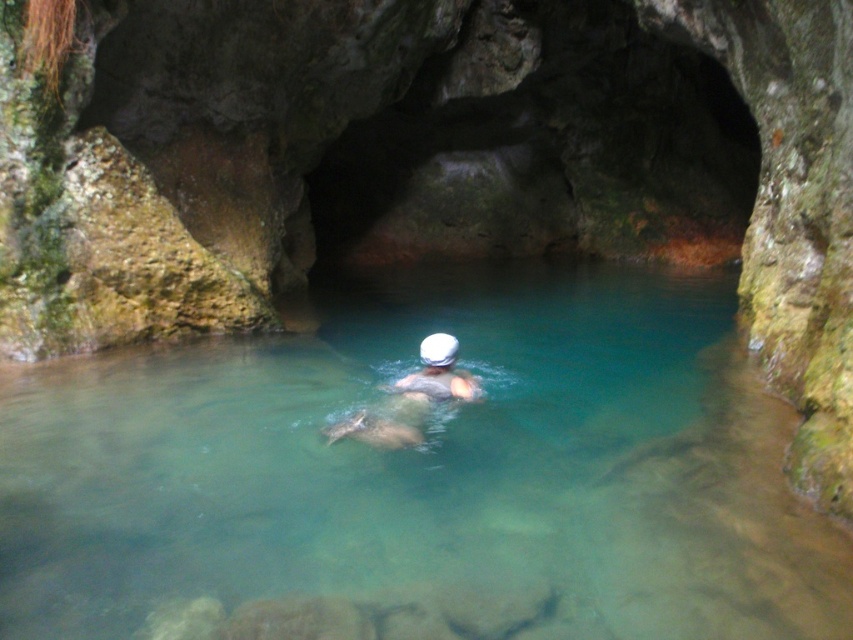
Question: Can you confirm if clear water at center is positioned below white matte swim cap at center?

Choices:
 (A) yes
 (B) no

Answer: (B)

Question: Does clear water at center lie behind white matte swim cap at center?

Choices:
 (A) no
 (B) yes

Answer: (A)

Question: Which point is farther from the camera taking this photo?

Choices:
 (A) (457, 400)
 (B) (820, 605)

Answer: (A)

Question: Can you confirm if clear water at center is positioned below white matte swim cap at center?

Choices:
 (A) yes
 (B) no

Answer: (B)

Question: Which object is farther from the camera taking this photo?

Choices:
 (A) clear water at center
 (B) white matte swim cap at center

Answer: (B)